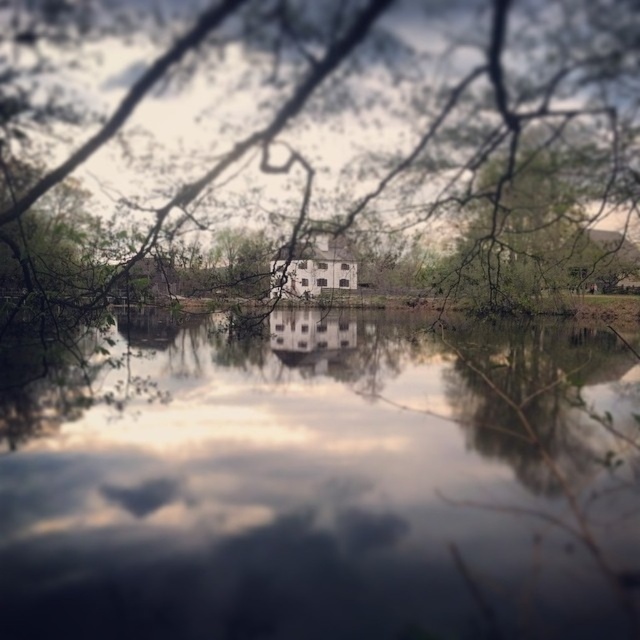
Question: Does transparent glass water at center have a greater width compared to green leafy branches at center?

Choices:
 (A) no
 (B) yes

Answer: (A)

Question: Does transparent glass water at center have a greater width compared to green leafy branches at center?

Choices:
 (A) no
 (B) yes

Answer: (A)

Question: Among these points, which one is nearest to the camera?

Choices:
 (A) (508, 164)
 (B) (298, 588)

Answer: (B)

Question: Is transparent glass water at center to the right of green leafy branches at center from the viewer's perspective?

Choices:
 (A) no
 (B) yes

Answer: (A)

Question: Which point is farther to the camera?

Choices:
 (A) green leafy branches at center
 (B) transparent glass water at center

Answer: (A)